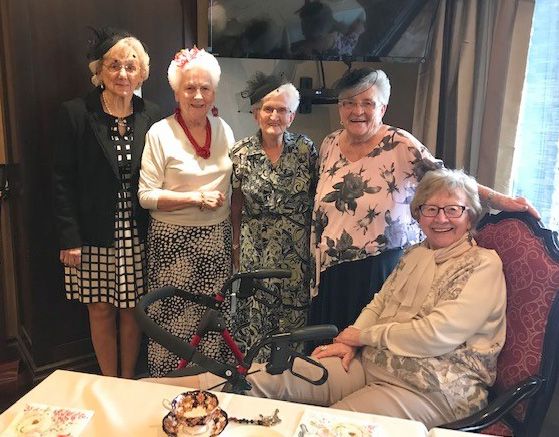
This screenshot has width=559, height=437. Find the location of `tv`. tv is located at coordinates (352, 55).